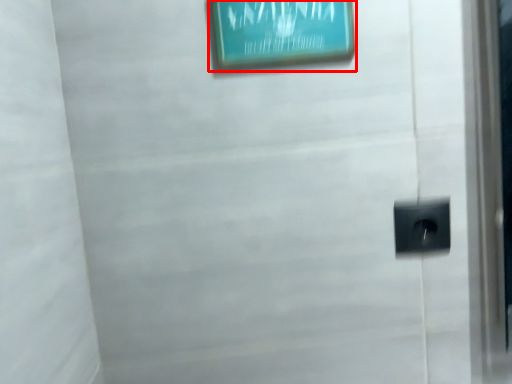
Question: From the image, what is the correct spatial relationship of picture frame (annotated by the red box) in relation to electric outlet?

Choices:
 (A) right
 (B) left

Answer: (B)